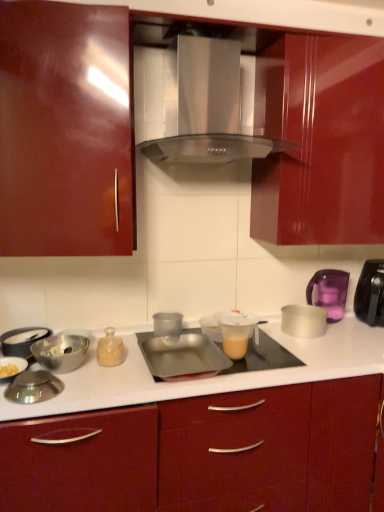
At what (x,y) coordinates should I click in order to perform the action: click on vacant space underneath shiny silver lid at lower left, positioned as the 6th appliance in right-to-left order (from a real-world perspective). Please return your answer as a coordinate pair (x, y). The width and height of the screenshot is (384, 512). Looking at the image, I should click on (35, 398).